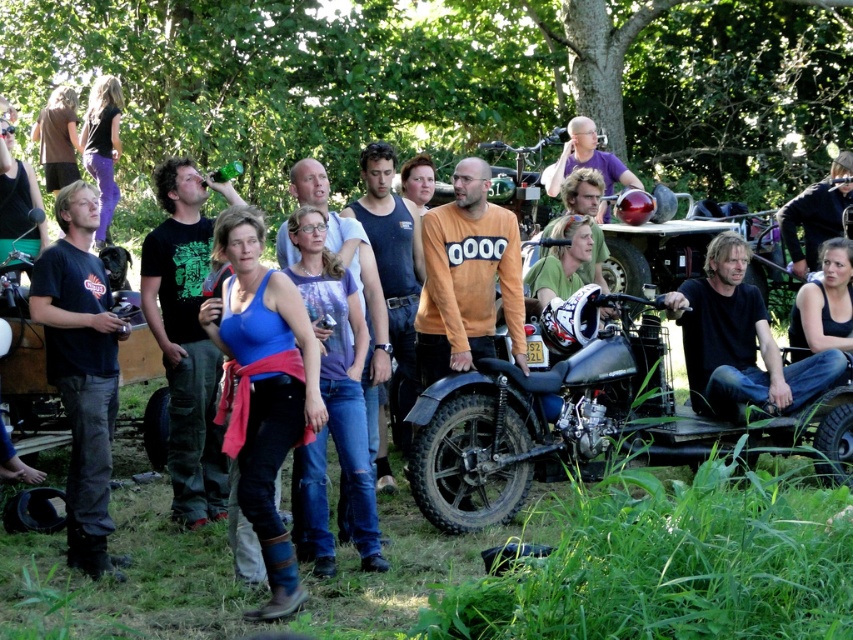
Question: Which of the following is the farthest from the observer?

Choices:
 (A) coord(581,166)
 (B) coord(740,397)

Answer: (A)

Question: Which object appears closest to the camera in this image?

Choices:
 (A) dark brown leather jacket at lower right
 (B) matte black motorcycle at center

Answer: (B)

Question: Is matte black motorcycle at center to the right of dark brown leather jacket at lower right from the viewer's perspective?

Choices:
 (A) yes
 (B) no

Answer: (B)

Question: Among these points, which one is nearest to the camera?

Choices:
 (A) (711, 314)
 (B) (602, 202)
 (C) (646, 428)
 (D) (96, 525)

Answer: (D)

Question: Is matte blue tank top at center wider than dark brown leather jacket at lower right?

Choices:
 (A) no
 (B) yes

Answer: (A)

Question: From the image, what is the correct spatial relationship of matte blue tank top at center in relation to matte orange shirt at center?

Choices:
 (A) left
 (B) right

Answer: (A)